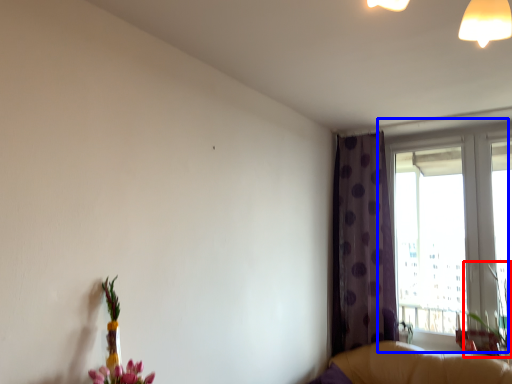
Question: Which point is closer to the camera, plant (highlighted by a red box) or window (highlighted by a blue box)?

Choices:
 (A) plant
 (B) window

Answer: (A)